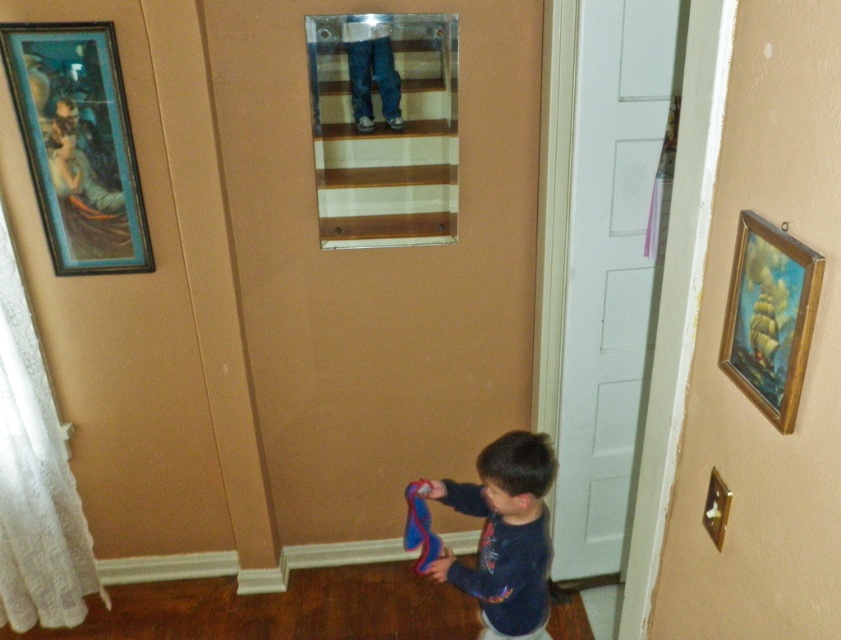
You are standing in the hallway and want to hang a new picture frame exactly where the gold wooden picture frame at right is currently located. What are the coordinates where you should place it?

You should place the new picture frame at coordinates point (770,316) where the gold wooden picture frame at right is currently located.